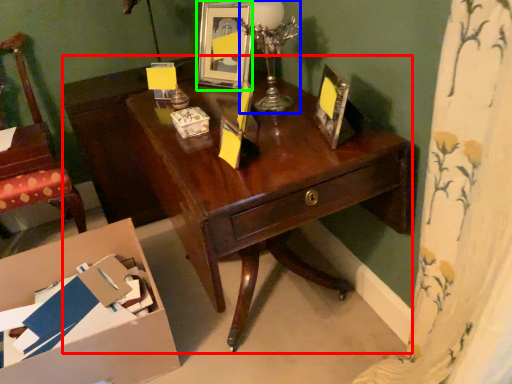
Question: Which object is the closest to the desk (highlighted by a red box)? Choose among these: candle holder (highlighted by a blue box) or picture frame (highlighted by a green box).

Choices:
 (A) candle holder
 (B) picture frame

Answer: (B)